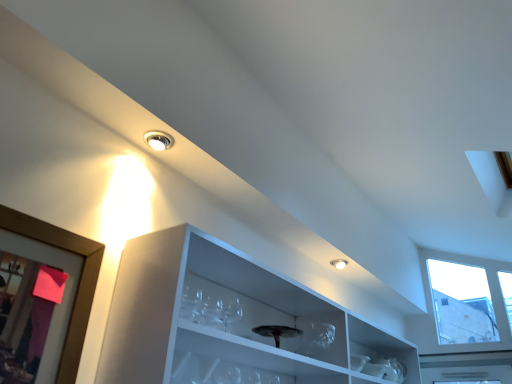
Measure the distance between wooden picture frame at left and camera.

wooden picture frame at left and camera are 39.15 inches apart from each other.

The image size is (512, 384). In order to click on clear glass wine glass at center in this screenshot , I will do `click(231, 313)`.

From the picture: Is clear glass wine glass at center bigger or smaller than wooden picture frame at left?

clear glass wine glass at center is smaller than wooden picture frame at left.

This screenshot has width=512, height=384. Identify the location of picture frame located in front of the clear glass wine glass at center. (78, 285).

Are clear glass wine glass at center and wooden picture frame at left beside each other?

No, clear glass wine glass at center is not next to wooden picture frame at left.

From the picture: Is clear glass wine glass at center closer to the viewer compared to wooden picture frame at left?

No, the depth of clear glass wine glass at center is greater than that of wooden picture frame at left.

Is clear glass wine glass at center turned away from matte white droplight at upper center?

No, clear glass wine glass at center is not facing the opposite direction of matte white droplight at upper center.

Where is `wine glass that is below the matte white droplight at upper center (from the image's perspective)`? The image size is (512, 384). wine glass that is below the matte white droplight at upper center (from the image's perspective) is located at coordinates (231, 313).

Who is bigger, clear glass wine glass at center or matte white droplight at upper center?

Bigger between the two is clear glass wine glass at center.

From the image's perspective, is clear glass wine glass at center located beneath matte white droplight at upper center?

Yes, from the image's perspective, clear glass wine glass at center is below matte white droplight at upper center.

The image size is (512, 384). I want to click on wine glass that appears below the matte white droplight at upper center (from the image's perspective), so click(231, 313).

Considering the positions of objects matte white droplight at upper center and clear glass wine glass at center in the image provided, who is more to the right, matte white droplight at upper center or clear glass wine glass at center?

clear glass wine glass at center is more to the right.

From the image's perspective, is matte white droplight at upper center on top of clear glass wine glass at center?

Correct, matte white droplight at upper center appears higher than clear glass wine glass at center in the image.

Does matte white droplight at upper center have a greater height compared to clear glass wine glass at center?

No.

Relative to wooden picture frame at left, is matte white droplight at upper center in front or behind?

In the image, matte white droplight at upper center appears behind wooden picture frame at left.

Could you tell me if matte white droplight at upper center is turned towards wooden picture frame at left?

No, matte white droplight at upper center is not oriented towards wooden picture frame at left.

The image size is (512, 384). Identify the location of picture frame on the left of matte white droplight at upper center. (78, 285).

Looking at their sizes, would you say wooden picture frame at left is wider or thinner than matte white droplight at upper center?

In the image, wooden picture frame at left appears to be more narrow than matte white droplight at upper center.

Which of these two, wooden picture frame at left or matte white droplight at upper center, stands shorter?

matte white droplight at upper center is shorter.

Is wooden picture frame at left oriented towards matte white droplight at upper center?

No, wooden picture frame at left is not oriented towards matte white droplight at upper center.

Is wooden picture frame at left with clear glass wine glass at center?

They are not placed beside each other.

Where is `picture frame directly beneath the clear glass wine glass at center (from a real-world perspective)`? This screenshot has width=512, height=384. picture frame directly beneath the clear glass wine glass at center (from a real-world perspective) is located at coordinates (78, 285).

Who is taller, wooden picture frame at left or clear glass wine glass at center?

Standing taller between the two is wooden picture frame at left.

Considering the sizes of wooden picture frame at left and clear glass wine glass at center in the image, is wooden picture frame at left wider or thinner than clear glass wine glass at center?

Considering their sizes, wooden picture frame at left looks slimmer than clear glass wine glass at center.

At what (x,y) coordinates should I click in order to perform the action: click on picture frame that is on the left side of clear glass wine glass at center. Please return your answer as a coordinate pair (x, y). Looking at the image, I should click on (78, 285).

At what (x,y) coordinates should I click in order to perform the action: click on wine glass below the matte white droplight at upper center (from a real-world perspective). Please return your answer as a coordinate pair (x, y). Looking at the image, I should click on pos(231,313).

From the image, which object appears to be nearer to matte white droplight at upper center, wooden picture frame at left or clear glass wine glass at center?

The object closer to matte white droplight at upper center is wooden picture frame at left.

Considering their positions, is matte white droplight at upper center positioned further to wooden picture frame at left than clear glass wine glass at center?

Among the two, clear glass wine glass at center is located further to wooden picture frame at left.

Considering their positions, is clear glass wine glass at center positioned further to wooden picture frame at left than matte white droplight at upper center?

Answer: clear glass wine glass at center is positioned further to the anchor wooden picture frame at left.

Estimate the real-world distances between objects in this image. Which object is further from matte white droplight at upper center, clear glass wine glass at center or wooden picture frame at left?

clear glass wine glass at center lies further to matte white droplight at upper center than the other object.

Based on their spatial positions, is wooden picture frame at left or matte white droplight at upper center closer to clear glass wine glass at center?

wooden picture frame at left is positioned closer to the anchor clear glass wine glass at center.

Estimate the real-world distances between objects in this image. Which object is closer to clear glass wine glass at center, matte white droplight at upper center or wooden picture frame at left?

wooden picture frame at left lies closer to clear glass wine glass at center than the other object.

Locate an element on the screen. picture frame between matte white droplight at upper center and clear glass wine glass at center in the up-down direction is located at coordinates (78, 285).